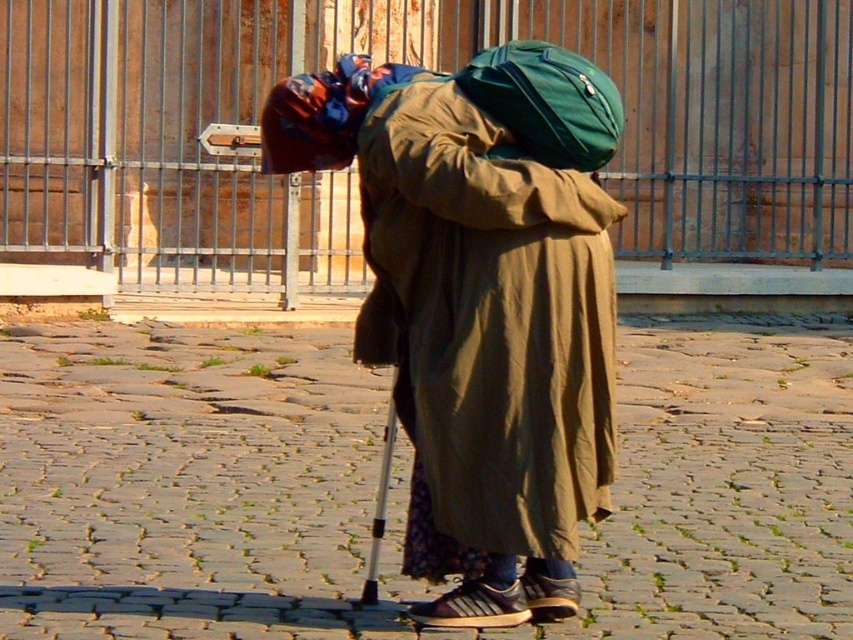
Question: Can you confirm if brown cobblestone at center is bigger than green fabric backpack at center?

Choices:
 (A) yes
 (B) no

Answer: (A)

Question: Does brown cobblestone at center have a larger size compared to green fabric backpack at center?

Choices:
 (A) no
 (B) yes

Answer: (B)

Question: Is the position of brown cobblestone at center less distant than that of green fabric backpack at center?

Choices:
 (A) yes
 (B) no

Answer: (B)

Question: Which of the following is the farthest from the observer?

Choices:
 (A) brown cobblestone at center
 (B) matte olive-green robe at center
 (C) green fabric backpack at center

Answer: (A)

Question: Which object appears farthest from the camera in this image?

Choices:
 (A) brown cobblestone at center
 (B) matte olive-green robe at center

Answer: (A)

Question: Which point appears farthest from the camera in this image?

Choices:
 (A) (618, 141)
 (B) (39, 614)

Answer: (B)